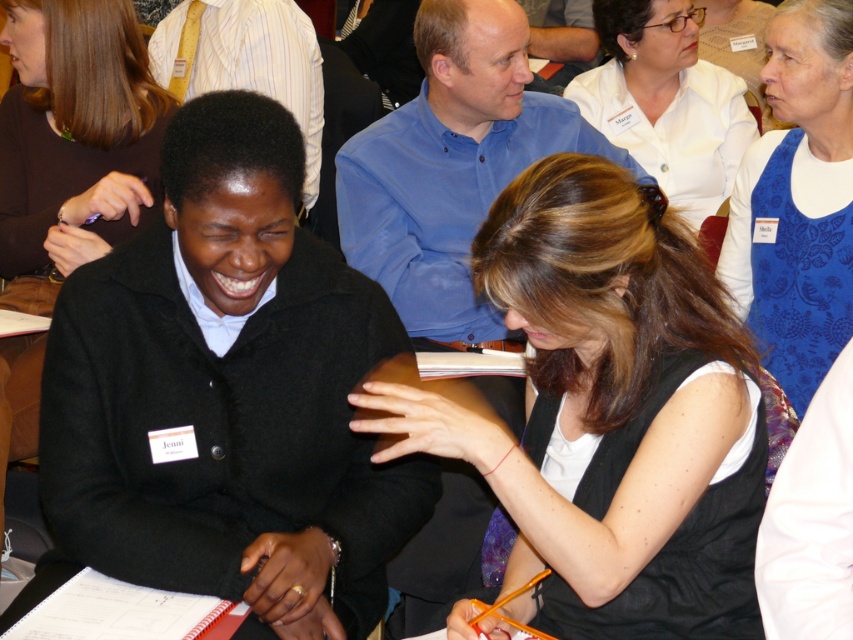
Can you confirm if blue paisley scarf at upper right is wider than white matte shirt at upper center?

In fact, blue paisley scarf at upper right might be narrower than white matte shirt at upper center.

Between point (769, 140) and point (662, 122), which one is positioned behind?

Point (662, 122)

The height and width of the screenshot is (640, 853). In order to click on blue paisley scarf at upper right in this screenshot , I will do `click(798, 200)`.

Between matte black vest at center and matte black jacket at left, which one has less height?

With less height is matte black vest at center.

Can you confirm if matte black vest at center is thinner than matte black jacket at left?

No, matte black vest at center is not thinner than matte black jacket at left.

Identify the location of matte black vest at center. Image resolution: width=853 pixels, height=640 pixels. (610, 413).

You are a GUI agent. You are given a task and a screenshot of the screen. Output one action in this format:
    pyautogui.click(x=<x>, y=<y>)
    Task: Click on the matte black vest at center
    Image resolution: width=853 pixels, height=640 pixels.
    Given the screenshot: What is the action you would take?
    pyautogui.click(x=610, y=413)

Does matte black vest at center have a larger size compared to white matte shirt at upper center?

No, matte black vest at center is not bigger than white matte shirt at upper center.

Does point (669, 632) come farther from viewer compared to point (616, 58)?

No, it is not.

What do you see at coordinates (610, 413) in the screenshot?
I see `matte black vest at center` at bounding box center [610, 413].

Locate an element on the screen. matte black vest at center is located at coordinates (610, 413).